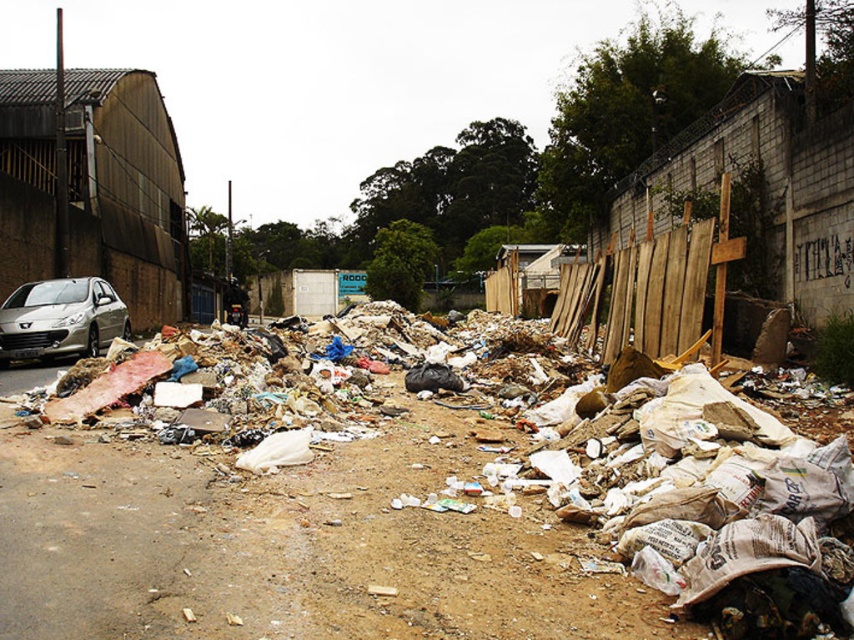
Between point (237, 458) and point (110, 324), which one is positioned in front?

Point (237, 458) is more forward.

Is point (268, 426) farther from camera compared to point (27, 328)?

No, it is in front of (27, 328).

This screenshot has height=640, width=854. Identify the location of brown paper bags at center. (401, 506).